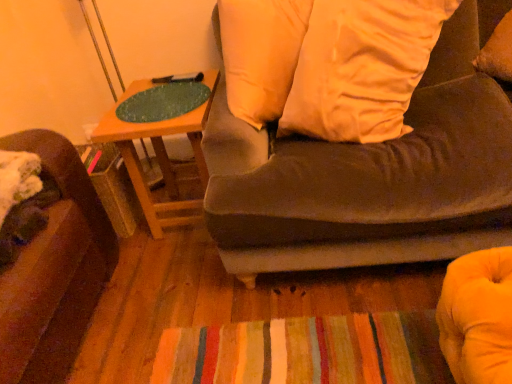
Find the location of a particular element. The image size is (512, 384). empty space that is ontop of wooden table at upper center is located at coordinates (160, 99).